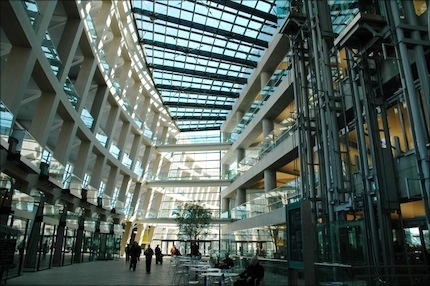
Locate an element on the screen. plant is located at coordinates tap(196, 213).